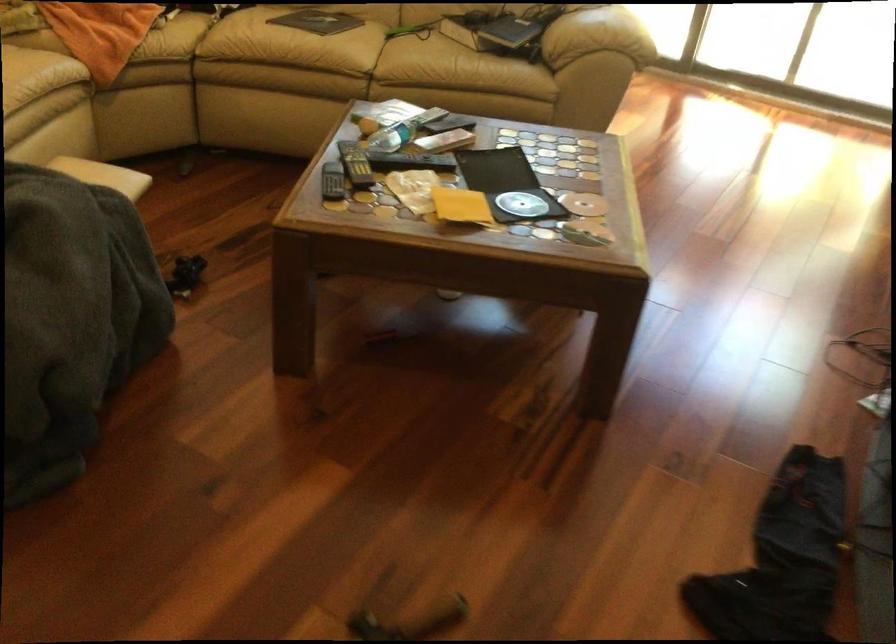
You are a GUI agent. You are given a task and a screenshot of the screen. Output one action in this format:
    pyautogui.click(x=<x>, y=<y>)
    Task: Click on the black boot
    The height and width of the screenshot is (644, 896).
    Given the screenshot: What is the action you would take?
    pyautogui.click(x=316, y=21)